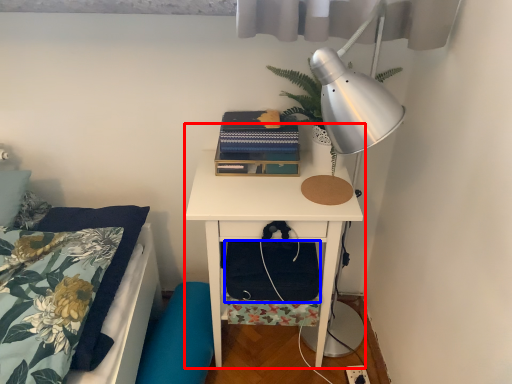
Question: Which of the following is the farthest to the observer, nightstand (highlighted by a red box) or footrest (highlighted by a blue box)?

Choices:
 (A) nightstand
 (B) footrest

Answer: (B)